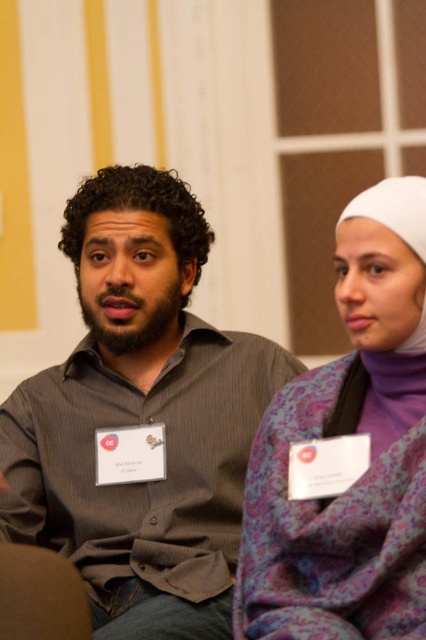
Question: Estimate the real-world distances between objects in this image. Which object is closer to the purple paisley scarf at center?

Choices:
 (A) white fabric headscarf at upper right
 (B) gray shirt at center

Answer: (A)

Question: Which point is closer to the camera?

Choices:
 (A) (71, 486)
 (B) (412, 212)

Answer: (B)

Question: Considering the relative positions of gray shirt at center and purple paisley scarf at center in the image provided, where is gray shirt at center located with respect to purple paisley scarf at center?

Choices:
 (A) left
 (B) right

Answer: (A)

Question: Which object is farther from the camera taking this photo?

Choices:
 (A) gray shirt at center
 (B) white fabric headscarf at upper right

Answer: (A)

Question: Can you confirm if gray shirt at center is positioned to the left of white fabric headscarf at upper right?

Choices:
 (A) no
 (B) yes

Answer: (B)

Question: Is purple paisley scarf at center in front of white fabric headscarf at upper right?

Choices:
 (A) yes
 (B) no

Answer: (A)